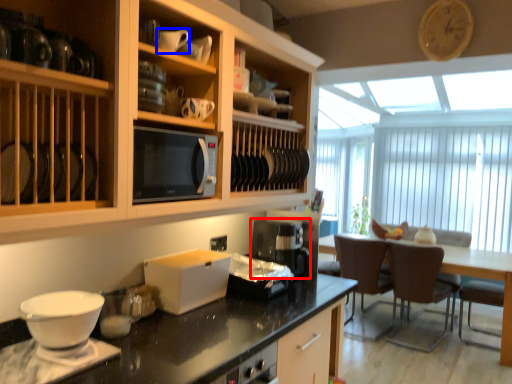
Question: Which of the following is the closest to the observer, kitchen appliance (highlighted by a red box) or tableware (highlighted by a blue box)?

Choices:
 (A) kitchen appliance
 (B) tableware

Answer: (B)